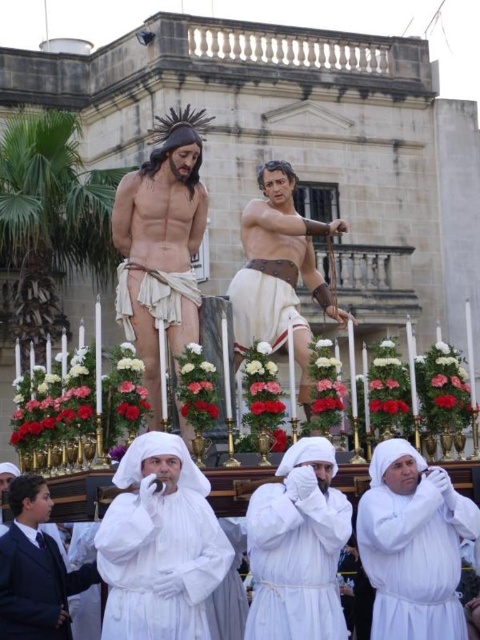
Question: Is white cloth at center behind white cotton robe at lower center?

Choices:
 (A) no
 (B) yes

Answer: (A)

Question: Which object appears closest to the camera in this image?

Choices:
 (A) matte wooden statue at center
 (B) white clothed man at lower left
 (C) smooth white statue at center

Answer: (B)

Question: Which of the following is the farthest from the observer?

Choices:
 (A) white cloth at center
 (B) matte wooden statue at center

Answer: (B)

Question: Among these points, which one is farthest from the camera?

Choices:
 (A) (440, 609)
 (B) (4, 632)
 (C) (144, 490)
 (D) (288, 582)

Answer: (A)

Question: Does matte wooden statue at center have a greater width compared to smooth white statue at center?

Choices:
 (A) no
 (B) yes

Answer: (A)

Question: Is matte wooden statue at center positioned at the back of white clothed man at lower left?

Choices:
 (A) no
 (B) yes

Answer: (B)